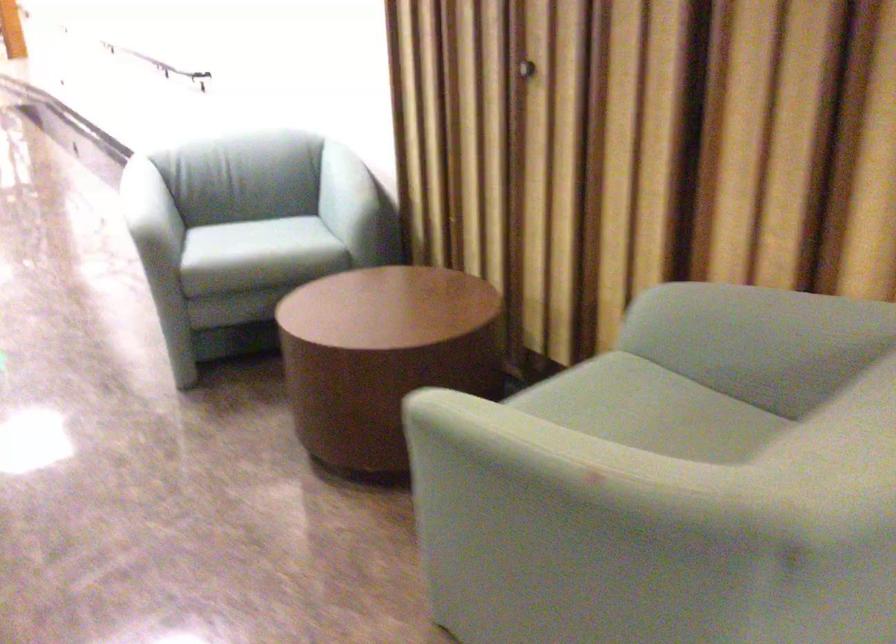
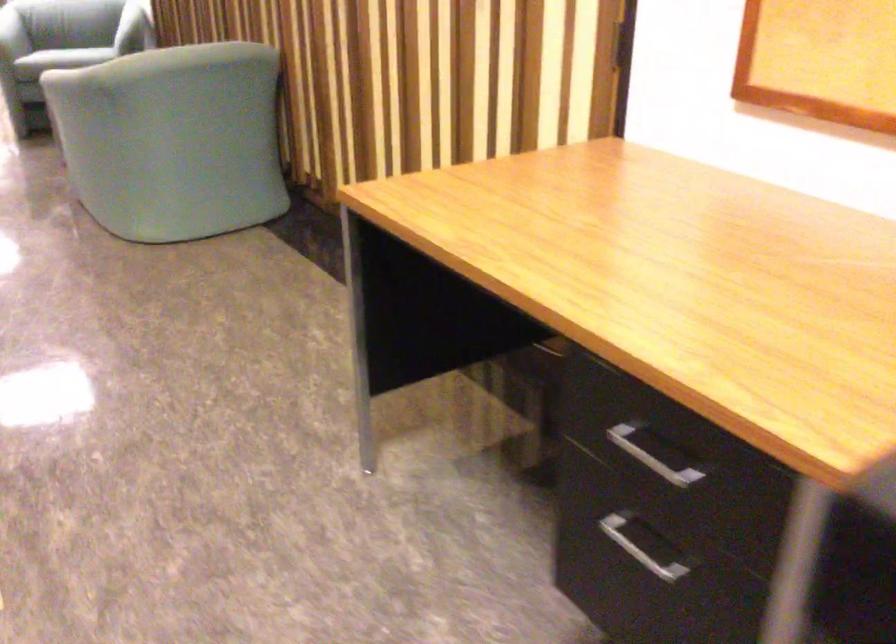
Question: I am providing you with two images of the same scene from different viewpoints. Please identify which objects are invisible in image2.

Choices:
 (A) metal drawer handle
 (B) chair armrest
 (C) black baseball cap
 (D) chair sitting surface

Answer: (D)